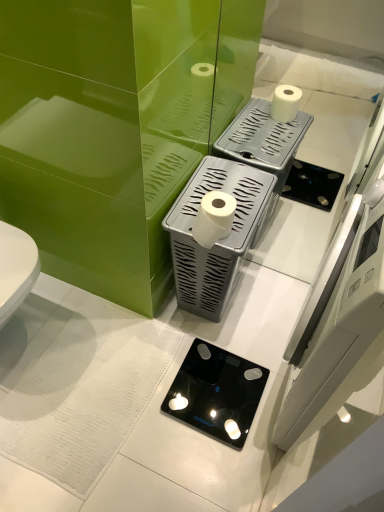
Locate an element on the screen. The image size is (384, 512). free space to the left of black glass scale at center, the second appliance when ordered from top to bottom is located at coordinates (143, 387).